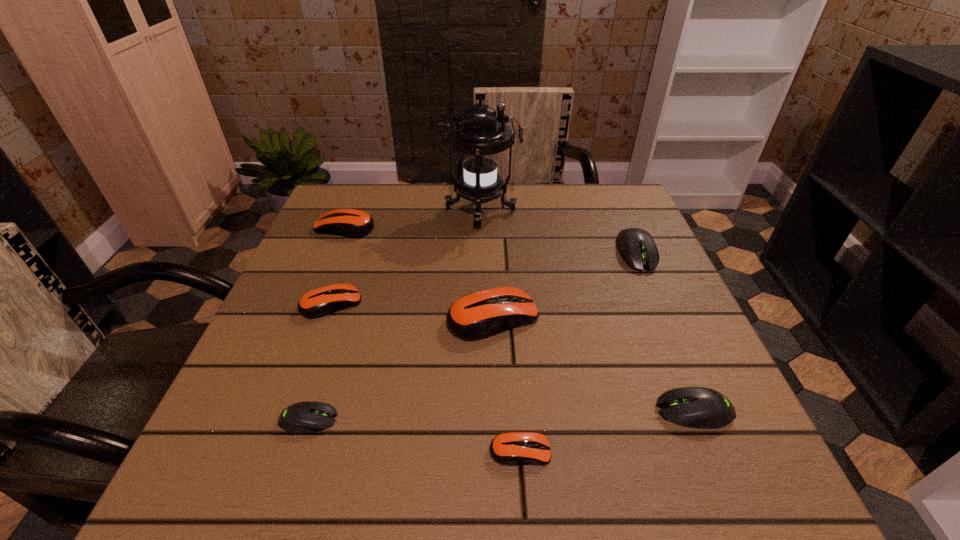
Find the location of a particular element. The height and width of the screenshot is (540, 960). black lantern is located at coordinates (480, 134).

Locate an element on the screen. the tallest object is located at coordinates (480, 134).

The width and height of the screenshot is (960, 540). I want to click on the biggest orange computer mouse, so click(479, 315).

The image size is (960, 540). What are the coordinates of `the biggest gray computer mouse` in the screenshot? It's located at (637, 248).

Find the location of a particular element. the farthest orange computer mouse is located at coordinates (353, 223).

Identify the location of the second biggest gray computer mouse. (695, 407).

The width and height of the screenshot is (960, 540). I want to click on the second smallest orange computer mouse, so click(x=320, y=302).

Identify the location of the leftmost gray computer mouse. (303, 417).

Where is `the nearest computer mouse`? The width and height of the screenshot is (960, 540). the nearest computer mouse is located at coordinates (512, 448).

In order to click on the nearest orange computer mouse in this screenshot , I will do 512,448.